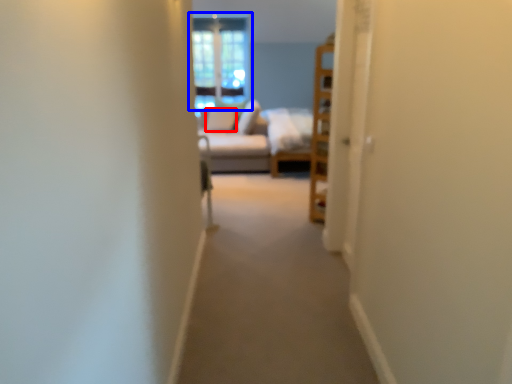
Question: Which object is further to the camera taking this photo, pillow (highlighted by a red box) or window (highlighted by a blue box)?

Choices:
 (A) pillow
 (B) window

Answer: (B)